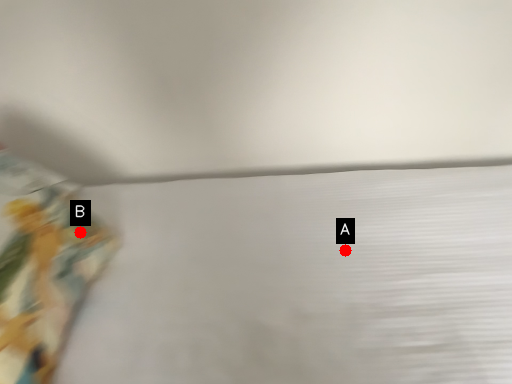
Question: Two points are circled on the image, labeled by A and B beside each circle. Which of the following is the closest to the observer?

Choices:
 (A) A is closer
 (B) B is closer

Answer: (B)